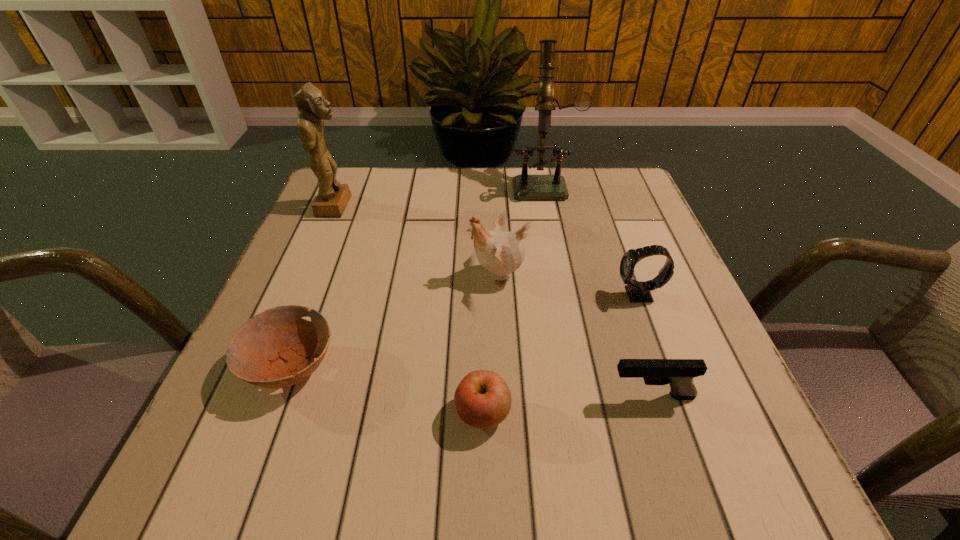
The image size is (960, 540). Identify the location of blank space located at the beak of the bird. (381, 275).

Where is `vacant space located at the beak of the bird`? Image resolution: width=960 pixels, height=540 pixels. vacant space located at the beak of the bird is located at coordinates (405, 275).

I want to click on free space located on the face of the watch, so click(x=585, y=295).

Locate an element on the screen. The image size is (960, 540). free space located 0.120m on the face of the watch is located at coordinates (555, 295).

Identify the location of vacant position located on the face of the watch. Image resolution: width=960 pixels, height=540 pixels. (535, 295).

Find the location of a particular element. vacant space located 0.100m on the front-facing side of the pistol is located at coordinates coord(545,396).

In order to click on vacant region located on the front-facing side of the pistol in this screenshot , I will do `click(502, 396)`.

The width and height of the screenshot is (960, 540). Find the location of `vacant position located on the front-facing side of the pistol`. vacant position located on the front-facing side of the pistol is located at coordinates (391, 396).

The image size is (960, 540). In order to click on free space located on the back of the apple in this screenshot , I will do pos(482,267).

The width and height of the screenshot is (960, 540). Identify the location of free space located 0.210m on the back of the shortest object. (332, 258).